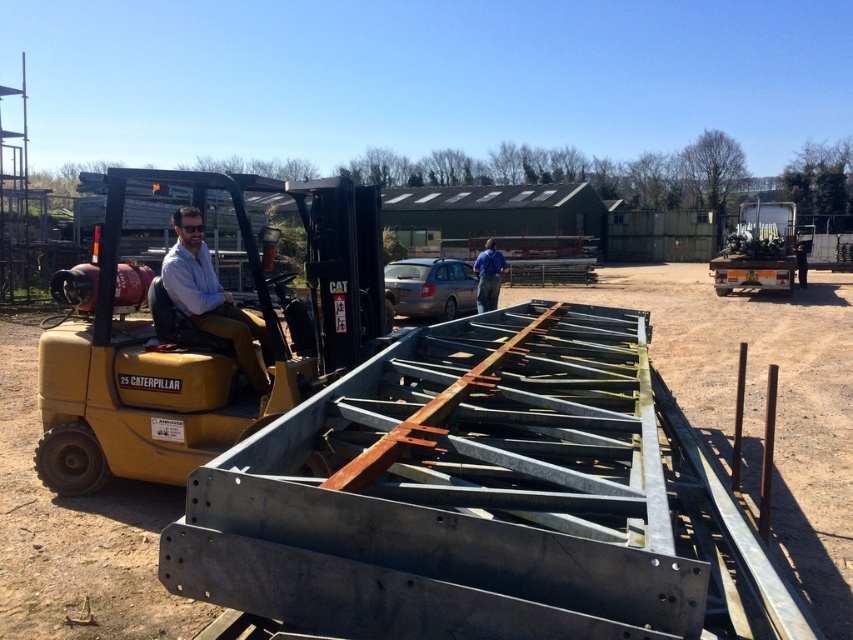
Question: Is matte yellow forklift at center to the left of blue fabric shirt at center from the viewer's perspective?

Choices:
 (A) yes
 (B) no

Answer: (A)

Question: Estimate the real-world distances between objects in this image. Which object is farther from the yellow metallic tractor at left?

Choices:
 (A) metallic silver tractor at right
 (B) matte yellow forklift at center
 (C) metal frame at center
 (D) blue fabric shirt at center

Answer: (A)

Question: Which point appears farthest from the camera in this image?

Choices:
 (A) (117, 536)
 (B) (202, 282)
 (C) (753, 264)
 (D) (482, 276)

Answer: (C)

Question: Can you confirm if matte yellow forklift at center is positioned to the left of metal frame at center?

Choices:
 (A) yes
 (B) no

Answer: (A)

Question: Which of the following is the farthest from the observer?

Choices:
 (A) matte yellow forklift at center
 (B) metal frame at center
 (C) blue fabric shirt at center

Answer: (C)

Question: Is the position of metallic silver tractor at right less distant than that of blue fabric shirt at center?

Choices:
 (A) no
 (B) yes

Answer: (A)